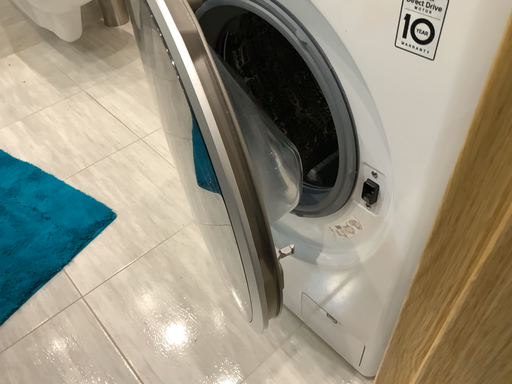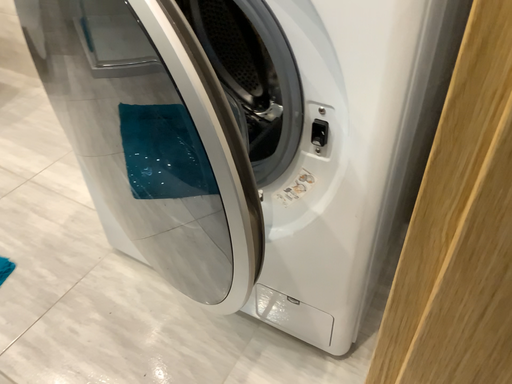
Question: How did the camera likely rotate when shooting the video?

Choices:
 (A) rotated downward
 (B) rotated upward

Answer: (B)